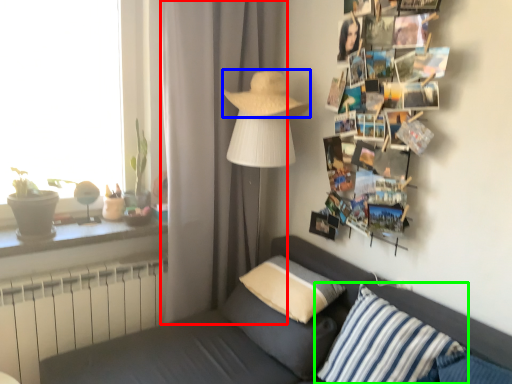
Question: Estimate the real-world distances between objects in this image. Which object is farther from curtain (highlighted by a red box), hat (highlighted by a blue box) or pillow (highlighted by a green box)?

Choices:
 (A) hat
 (B) pillow

Answer: (B)